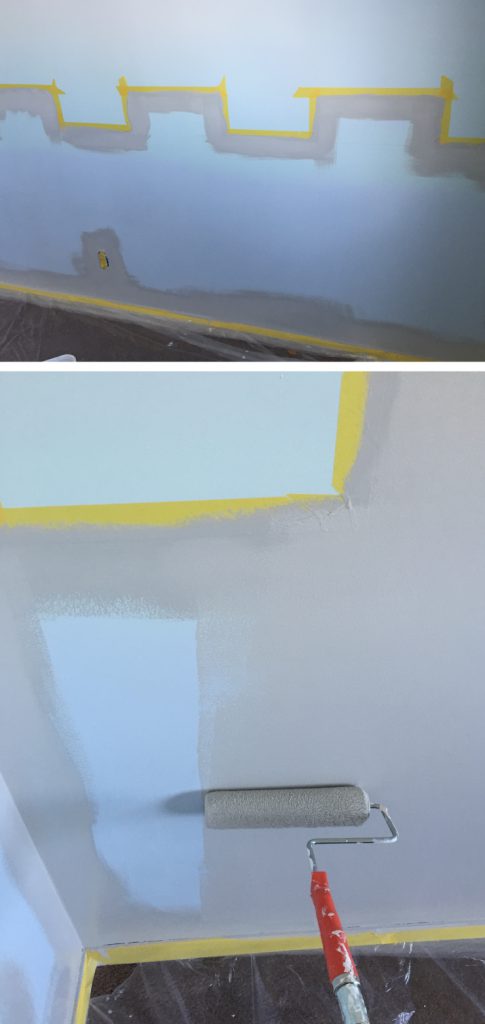
Can you point out all i bent metal section that connects to the handle of the paint roller and holds the fuzzy section the holds the paint in this image? Your answer should be formatted as a list of tuples, i.e. [(x1, y1), (x2, y2), ...], where each tuple contains the x and y coordinates of a point satisfying the conditions above.

[(356, 839)]